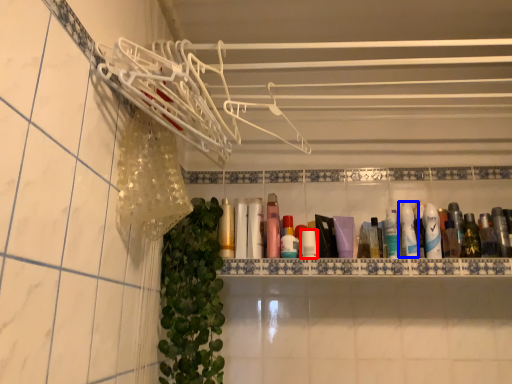
Question: Which of the following is the closest to the observer, toiletry (highlighted by a red box) or toiletry (highlighted by a blue box)?

Choices:
 (A) toiletry
 (B) toiletry

Answer: (A)